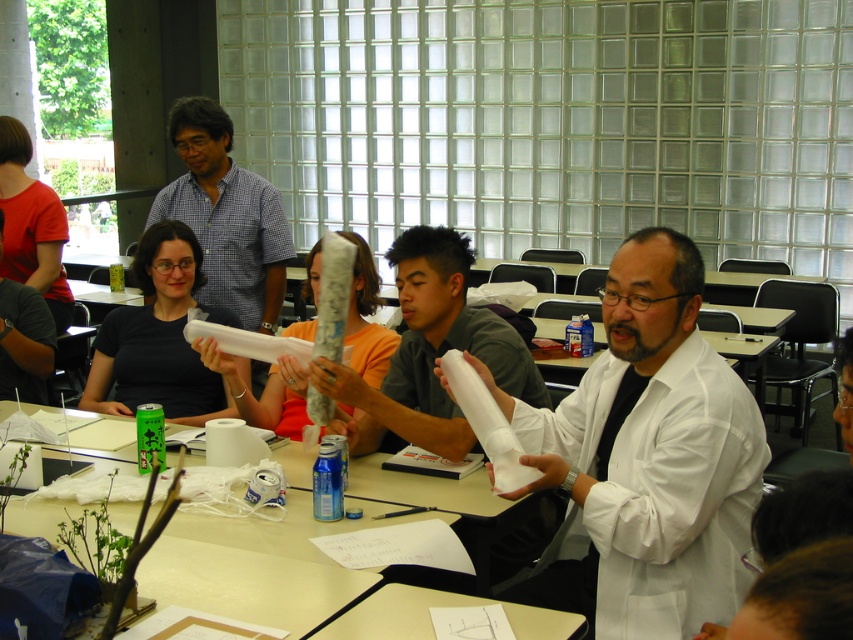
Which is below, white matte lab coat at center or matte gray paper towel at center?

white matte lab coat at center

Measure the distance between point (544, 586) and camera.

They are 2.12 meters apart.

Where is `white matte lab coat at center`? The image size is (853, 640). white matte lab coat at center is located at coordinates (645, 460).

Does point (476, 321) come farther from viewer compared to point (395, 614)?

Yes, point (476, 321) is behind point (395, 614).

Where is `matte gray paper towel at center`? The width and height of the screenshot is (853, 640). matte gray paper towel at center is located at coordinates (428, 353).

Is point (641, 621) positioned before point (398, 628)?

No.

What do you see at coordinates (645, 460) in the screenshot? This screenshot has width=853, height=640. I see `white matte lab coat at center` at bounding box center [645, 460].

Who is more distant from viewer, [631,538] or [404,618]?

The point [631,538] is behind.

Where is `white matte lab coat at center`? This screenshot has width=853, height=640. white matte lab coat at center is located at coordinates (645, 460).